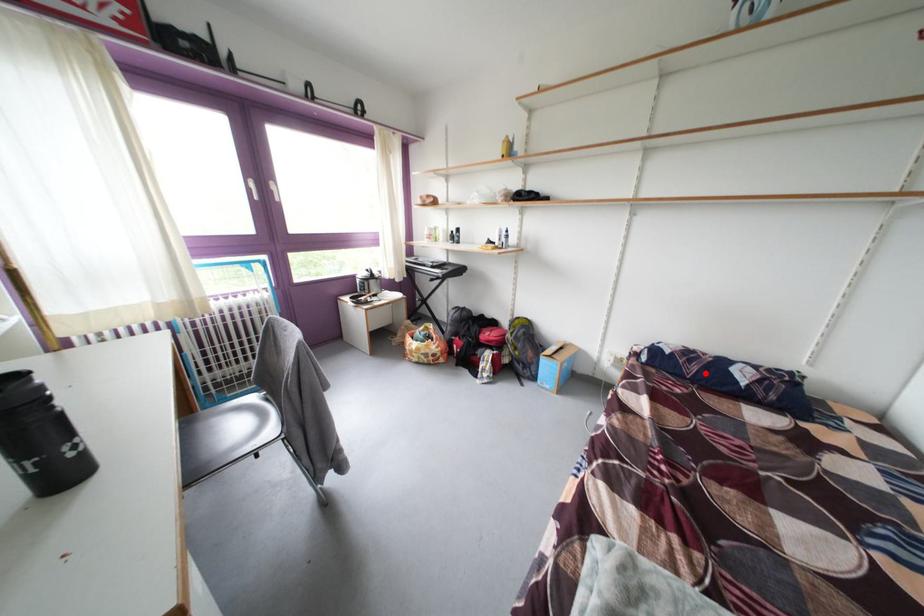
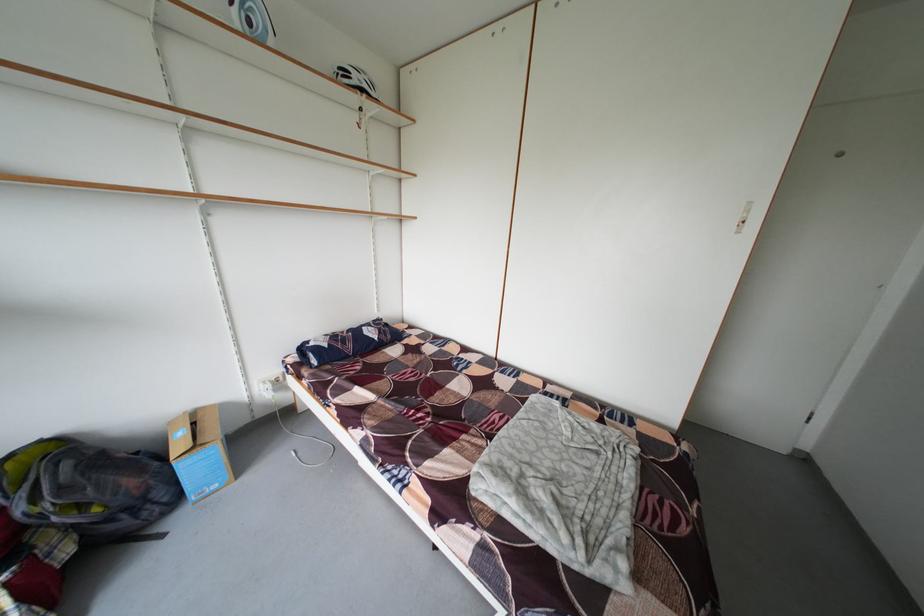
Locate, in the second image, the point that corresponds to the highlighted location in the first image.

(360, 351)